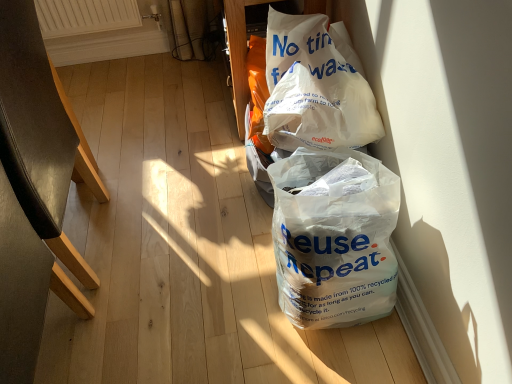
Identify the location of space that is in front of white plastic bag at lower right, arranged as the first plastic bag when ordered from the bottom. click(x=343, y=362).